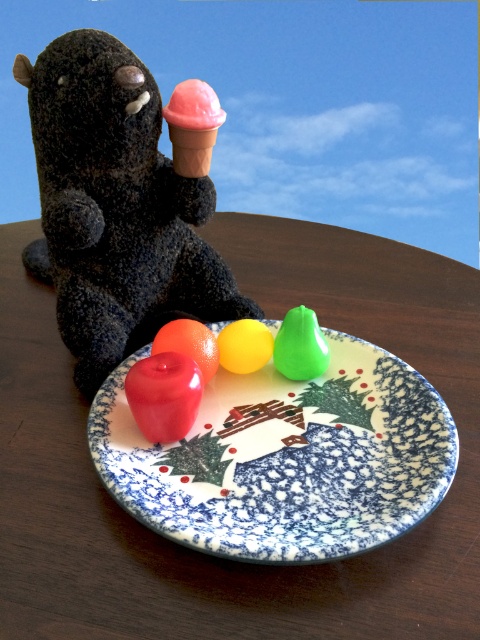
Between fuzzy black stuffed animal at left and pink matte ice cream cone at upper center, which one appears on the right side from the viewer's perspective?

Positioned to the right is pink matte ice cream cone at upper center.

Consider the image. Who is more distant from viewer, [126,141] or [194,168]?

The point [194,168] is more distant.

In order to click on fuzzy black stuffed animal at left in this screenshot , I will do click(x=115, y=208).

Is wooden table at center positioned at the back of pink matte ice cream cone at upper center?

No, it is in front of pink matte ice cream cone at upper center.

Between wooden table at center and pink matte ice cream cone at upper center, which one is positioned lower?

wooden table at center is below.

Does point (70, 552) lie in front of point (211, 120)?

Yes, it is.

Locate an element on the screen. This screenshot has width=480, height=640. wooden table at center is located at coordinates (205, 554).

Is point (58, 412) farther from viewer compared to point (51, 205)?

No.

The image size is (480, 640). Find the location of `wooden table at center`. wooden table at center is located at coordinates (205, 554).